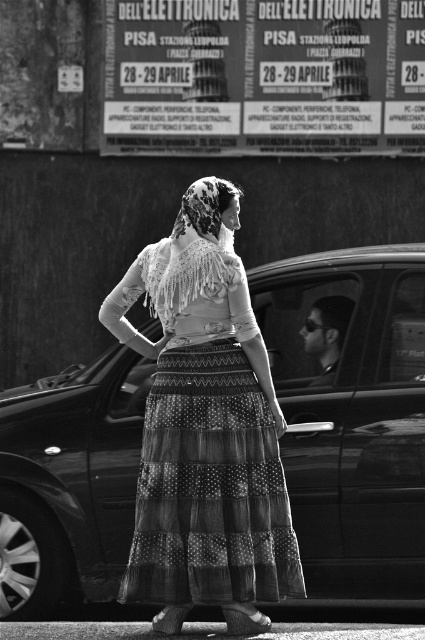
Is textured cotton dress at center in front of metallic poster at upper center?

Yes.

Is textured cotton dress at center to the left of metallic poster at upper center from the viewer's perspective?

Indeed, textured cotton dress at center is positioned on the left side of metallic poster at upper center.

What do you see at coordinates (206, 429) in the screenshot?
I see `textured cotton dress at center` at bounding box center [206, 429].

Find the location of a particular element. This screenshot has width=425, height=640. textured cotton dress at center is located at coordinates (206, 429).

Can you confirm if metallic car door at center is positioned below metallic poster at upper center?

Yes, metallic car door at center is below metallic poster at upper center.

Between point (115, 419) and point (231, 3), which one is positioned in front?

Point (115, 419) is in front.

Does point (368, 380) come behind point (350, 109)?

No, it is not.

At what (x,y) coordinates should I click in order to perform the action: click on metallic car door at center. Please return your answer as a coordinate pair (x, y). Looking at the image, I should click on (353, 416).

Can you confirm if metallic car door at center is thinner than textured cotton dress at center?

Yes, metallic car door at center is thinner than textured cotton dress at center.

Does metallic car door at center have a greater height compared to textured cotton dress at center?

No.

Is point (311, 557) farther from camera compared to point (127, 323)?

Yes, point (311, 557) is farther from viewer.

Find the location of a particular element. This screenshot has width=425, height=640. metallic car door at center is located at coordinates (353, 416).